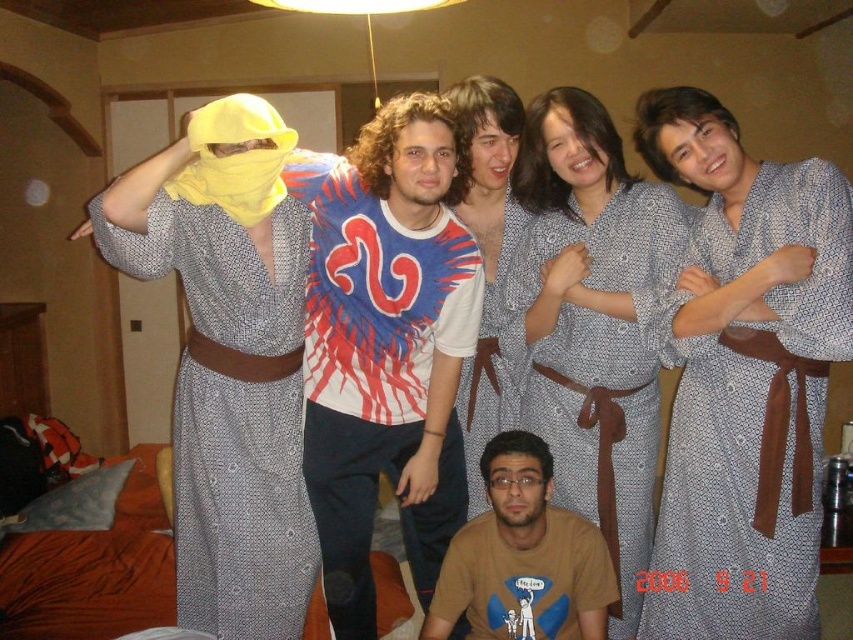
In the scene shown: Between textured gray robe at left and brown cotton t-shirt at lower center, which one is positioned lower?

brown cotton t-shirt at lower center

Who is more forward, (x=183, y=611) or (x=485, y=570)?

Point (x=183, y=611)

The image size is (853, 640). In order to click on textured gray robe at left in this screenshot , I will do `click(233, 413)`.

Is gray textured robe at center bigger than textured gray robe at center?

No, gray textured robe at center is not bigger than textured gray robe at center.

Consider the image. Can you confirm if gray textured robe at center is positioned below textured gray robe at center?

No, gray textured robe at center is not below textured gray robe at center.

The height and width of the screenshot is (640, 853). Identify the location of gray textured robe at center. (746, 378).

Does textured gray robe at left appear on the left side of textured blue shirt at center?

Indeed, textured gray robe at left is positioned on the left side of textured blue shirt at center.

At what (x,y) coordinates should I click in order to perform the action: click on textured gray robe at left. Please return your answer as a coordinate pair (x, y). This screenshot has height=640, width=853. Looking at the image, I should click on (233, 413).

Which is in front, point (273, 480) or point (474, 355)?

Positioned in front is point (273, 480).

Identify the location of textured gray robe at left. The height and width of the screenshot is (640, 853). (233, 413).